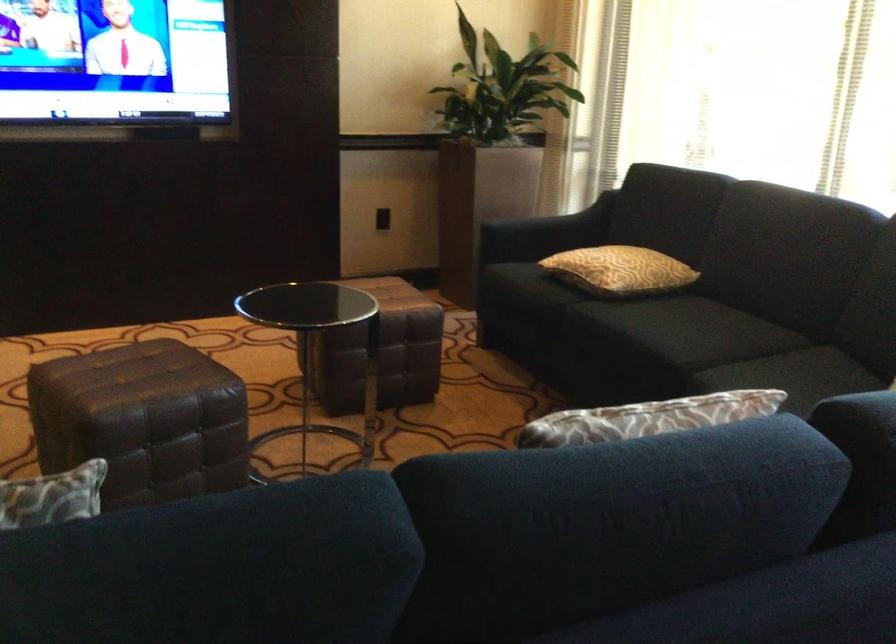
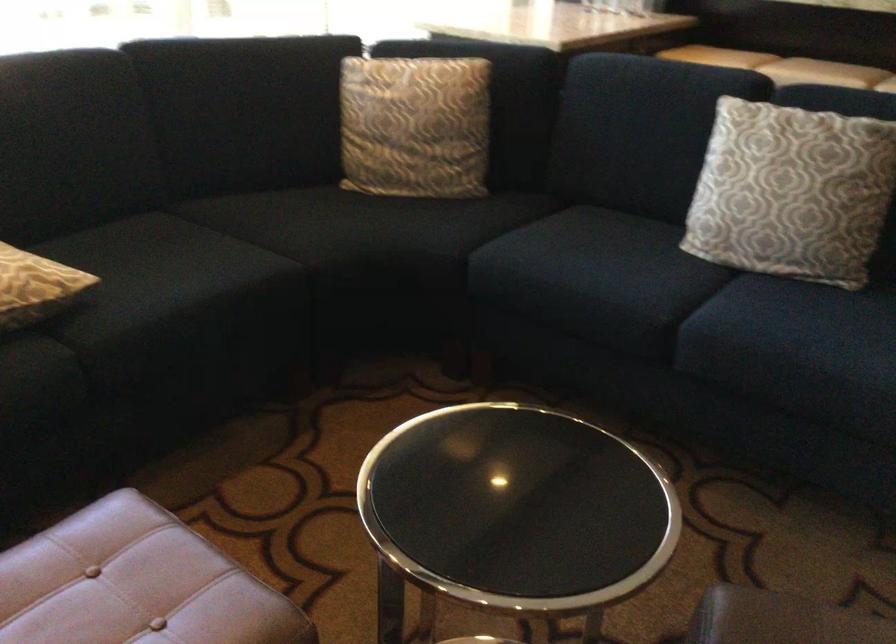
The point at (x=665, y=319) is marked in the first image. Where is the corresponding point in the second image?

(161, 270)